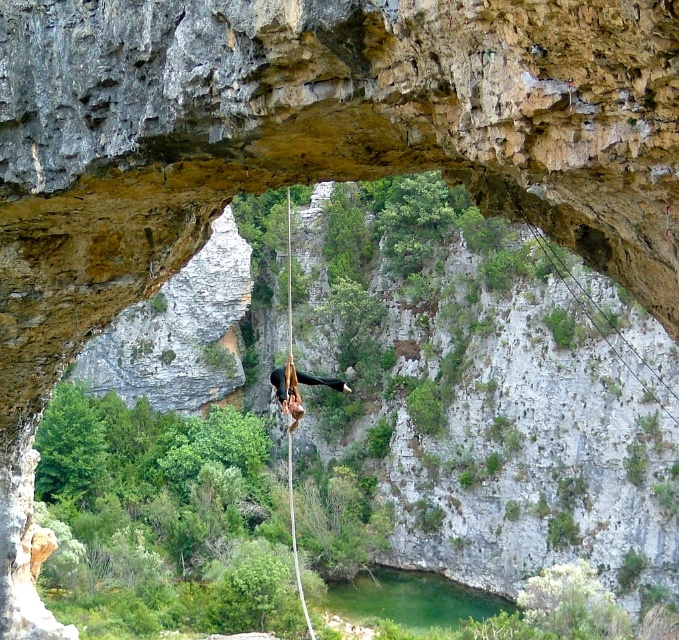
Who is more distant from viewer, [291,310] or [295,378]?

Positioned behind is point [291,310].

Does rope at center have a lesser width compared to black matte rock climber at center?

Correct, rope at center's width is less than black matte rock climber at center's.

Who is more distant from viewer, (x=299, y=408) or (x=342, y=392)?

Point (x=342, y=392)

Identify the location of rope at center. This screenshot has width=679, height=640. (293, 417).